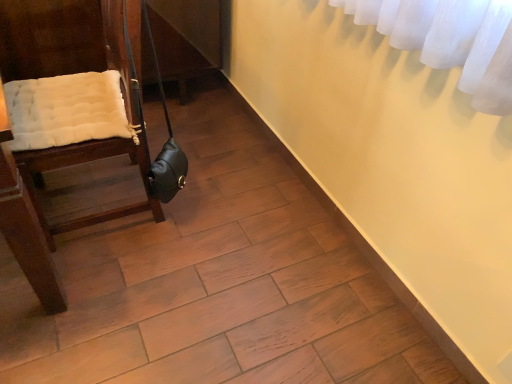
Question: Should I look upward or downward to see wooden chair with cushion at left?

Choices:
 (A) down
 (B) up

Answer: (B)

Question: Is wooden chair with cushion at left positioned in front of leather-like black bag at lower left?

Choices:
 (A) yes
 (B) no

Answer: (A)

Question: Is wooden chair with cushion at left positioned far away from leather-like black bag at lower left?

Choices:
 (A) no
 (B) yes

Answer: (A)

Question: Considering the relative positions of wooden chair with cushion at left and leather-like black bag at lower left in the image provided, is wooden chair with cushion at left to the left of leather-like black bag at lower left from the viewer's perspective?

Choices:
 (A) yes
 (B) no

Answer: (A)

Question: From the image's perspective, is wooden chair with cushion at left beneath leather-like black bag at lower left?

Choices:
 (A) yes
 (B) no

Answer: (B)

Question: Is the position of wooden chair with cushion at left more distant than that of leather-like black bag at lower left?

Choices:
 (A) yes
 (B) no

Answer: (B)

Question: From a real-world perspective, is wooden chair with cushion at left on top of leather-like black bag at lower left?

Choices:
 (A) yes
 (B) no

Answer: (B)

Question: Does leather-like black bag at lower left have a lesser width compared to wooden chair with cushion at left?

Choices:
 (A) yes
 (B) no

Answer: (A)

Question: Does leather-like black bag at lower left touch wooden chair with cushion at left?

Choices:
 (A) no
 (B) yes

Answer: (A)

Question: Considering the relative sizes of leather-like black bag at lower left and wooden chair with cushion at left in the image provided, is leather-like black bag at lower left smaller than wooden chair with cushion at left?

Choices:
 (A) yes
 (B) no

Answer: (A)

Question: Is leather-like black bag at lower left closer to the viewer compared to wooden chair with cushion at left?

Choices:
 (A) yes
 (B) no

Answer: (B)

Question: Can you confirm if leather-like black bag at lower left is positioned to the right of wooden chair with cushion at left?

Choices:
 (A) no
 (B) yes

Answer: (B)

Question: Is leather-like black bag at lower left positioned beyond the bounds of wooden chair with cushion at left?

Choices:
 (A) yes
 (B) no

Answer: (B)

Question: Looking at their shapes, would you say leather-like black bag at lower left is wider or thinner than wooden chair with cushion at left?

Choices:
 (A) thin
 (B) wide

Answer: (A)